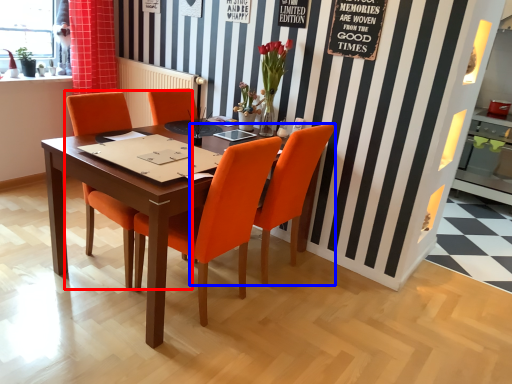
Question: Which object is closer to the camera taking this photo, chair (highlighted by a red box) or chair (highlighted by a blue box)?

Choices:
 (A) chair
 (B) chair

Answer: (A)